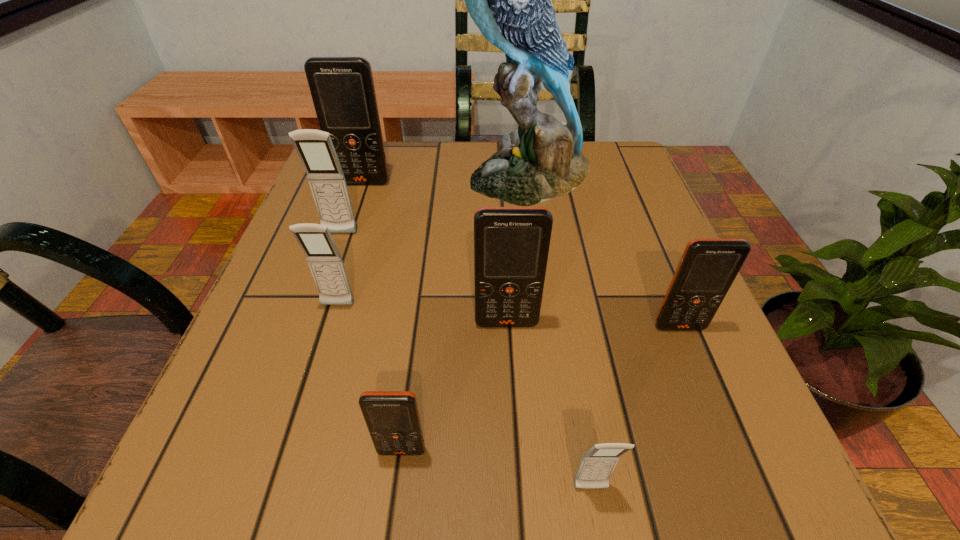
I want to click on free space between the second nearest object and the third farthest object, so click(371, 342).

Image resolution: width=960 pixels, height=540 pixels. Identify the location of empty location between the nearest gray cellular telephone and the fourth cellular telephone from right to left. (496, 470).

This screenshot has width=960, height=540. Identify the location of vacant area between the smallest orange cellular telephone and the second smallest gray cellular telephone. (370, 378).

The image size is (960, 540). What are the coordinates of `free space that is in between the nearest object and the rightmost orange cellular telephone` in the screenshot? It's located at coord(636,408).

Select which object appears as the sixth closest to the nearest object. Please provide its 2D coordinates. Your answer should be formatted as a tuple, i.e. [(x, y)], where the tuple contains the x and y coordinates of a point satisfying the conditions above.

[(315, 149)]

Choose which object is the seventh nearest neighbor to the third biggest orange cellular telephone. Please provide its 2D coordinates. Your answer should be formatted as a tuple, i.e. [(x, y)], where the tuple contains the x and y coordinates of a point satisfying the conditions above.

[(342, 88)]

At what (x,y) coordinates should I click in order to perform the action: click on cellular telephone that stands as the fourth closest to the rightmost object. Please return your answer as a coordinate pair (x, y). This screenshot has width=960, height=540. Looking at the image, I should click on (325, 262).

Select which cellular telephone is the third closest to the tallest object. Please provide its 2D coordinates. Your answer should be formatted as a tuple, i.e. [(x, y)], where the tuple contains the x and y coordinates of a point satisfying the conditions above.

[(511, 244)]

Locate which orange cellular telephone ranks third in proximity to the fourth farthest object. Please provide its 2D coordinates. Your answer should be formatted as a tuple, i.e. [(x, y)], where the tuple contains the x and y coordinates of a point satisfying the conditions above.

[(342, 88)]

Identify the location of the closest orange cellular telephone to the leftmost orange cellular telephone. (511, 244).